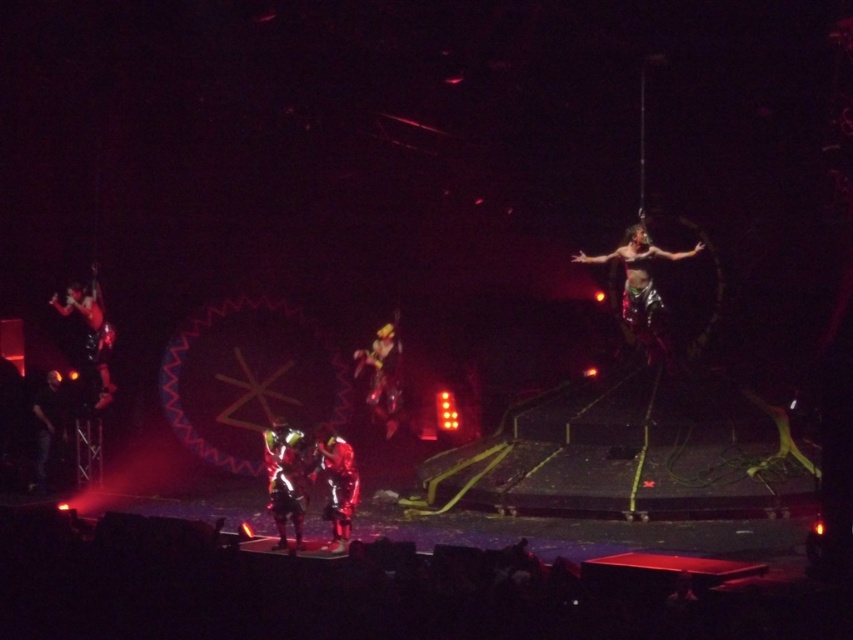
Is shiny metallic pants at upper right to the right of shiny metallic person at center from the viewer's perspective?

Indeed, shiny metallic pants at upper right is positioned on the right side of shiny metallic person at center.

Is point (635, 333) closer to camera compared to point (335, 524)?

That is False.

Where is `shiny metallic pants at upper right`? This screenshot has height=640, width=853. shiny metallic pants at upper right is located at coordinates (642, 289).

At what (x,y) coordinates should I click in order to perform the action: click on shiny metallic pants at upper right. Please return your answer as a coordinate pair (x, y). Looking at the image, I should click on (642, 289).

Is shiny metallic pants at upper right to the left of dark fabric figure at left from the viewer's perspective?

Incorrect, shiny metallic pants at upper right is not on the left side of dark fabric figure at left.

Between point (683, 259) and point (38, 488), which one is positioned behind?

The point (38, 488) is behind.

What do you see at coordinates (642, 289) in the screenshot? I see `shiny metallic pants at upper right` at bounding box center [642, 289].

You are a GUI agent. You are given a task and a screenshot of the screen. Output one action in this format:
    pyautogui.click(x=<x>, y=<y>)
    Task: Click on the shiny metallic pants at upper right
    
    Given the screenshot: What is the action you would take?
    pyautogui.click(x=642, y=289)

Is metallic gold costume at center positioned at the back of dark fabric figure at left?

Yes, it is behind dark fabric figure at left.

Between metallic gold costume at center and dark fabric figure at left, which one appears on the right side from the viewer's perspective?

From the viewer's perspective, metallic gold costume at center appears more on the right side.

Which is behind, point (392, 426) or point (50, 454)?

The point (392, 426) is more distant.

You are a GUI agent. You are given a task and a screenshot of the screen. Output one action in this format:
    pyautogui.click(x=<x>, y=<y>)
    Task: Click on the metallic gold costume at center
    This screenshot has width=853, height=640.
    Given the screenshot: What is the action you would take?
    pyautogui.click(x=383, y=374)